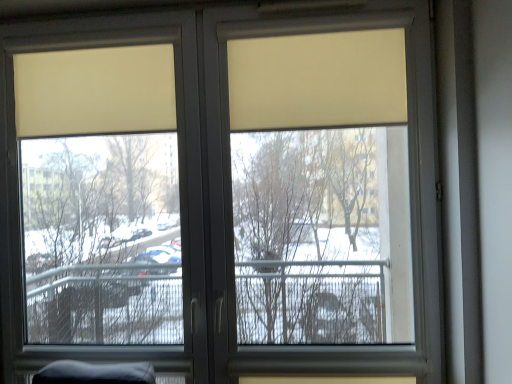
Question: Considering the relative sizes of matte plastic window screen at center and beige matte curtain at upper center, which is the 2th curtain in left-to-right order, in the image provided, is matte plastic window screen at center bigger than beige matte curtain at upper center, which is the 2th curtain in left-to-right order,?

Choices:
 (A) yes
 (B) no

Answer: (A)

Question: Is matte plastic window screen at center shorter than beige matte curtain at upper center, the 1th curtain viewed from the right?

Choices:
 (A) no
 (B) yes

Answer: (A)

Question: Does matte plastic window screen at center lie behind beige matte curtain at upper center, the 1th curtain viewed from the right?

Choices:
 (A) no
 (B) yes

Answer: (B)

Question: From a real-world perspective, is matte plastic window screen at center under beige matte curtain at upper center, the 1th curtain viewed from the right?

Choices:
 (A) yes
 (B) no

Answer: (A)

Question: Considering the relative sizes of matte plastic window screen at center and beige matte curtain at upper center, which is the 2th curtain in left-to-right order, in the image provided, is matte plastic window screen at center thinner than beige matte curtain at upper center, which is the 2th curtain in left-to-right order,?

Choices:
 (A) no
 (B) yes

Answer: (A)

Question: Considering the positions of matte plastic window screen at center and beige matte curtain at upper center, which is the 2th curtain in left-to-right order, in the image, is matte plastic window screen at center bigger or smaller than beige matte curtain at upper center, which is the 2th curtain in left-to-right order,?

Choices:
 (A) small
 (B) big

Answer: (B)

Question: Is point (15, 61) closer or farther from the camera than point (252, 99)?

Choices:
 (A) closer
 (B) farther

Answer: (B)

Question: Do you think matte plastic window screen at center is within beige matte curtain at upper center, the 1th curtain viewed from the right, or outside of it?

Choices:
 (A) inside
 (B) outside

Answer: (B)

Question: Is matte plastic window screen at center in front of or behind beige matte curtain at upper center, which is the 2th curtain in left-to-right order, in the image?

Choices:
 (A) front
 (B) behind

Answer: (B)

Question: Relative to beige matte curtain at upper left, the first curtain positioned from the left, is matte plastic window screen at center in front or behind?

Choices:
 (A) front
 (B) behind

Answer: (A)

Question: Is matte plastic window screen at center inside or outside of beige matte curtain at upper left, the second curtain viewed from the right?

Choices:
 (A) inside
 (B) outside

Answer: (B)

Question: Based on their sizes in the image, would you say matte plastic window screen at center is bigger or smaller than beige matte curtain at upper left, the first curtain positioned from the left?

Choices:
 (A) small
 (B) big

Answer: (B)

Question: From a real-world perspective, is matte plastic window screen at center positioned above or below beige matte curtain at upper left, the second curtain viewed from the right?

Choices:
 (A) above
 (B) below

Answer: (B)

Question: Would you say beige matte curtain at upper left, the second curtain viewed from the right, is inside or outside matte plastic window screen at center?

Choices:
 (A) inside
 (B) outside

Answer: (A)

Question: From a real-world perspective, is beige matte curtain at upper left, the first curtain positioned from the left, above or below matte plastic window screen at center?

Choices:
 (A) above
 (B) below

Answer: (A)